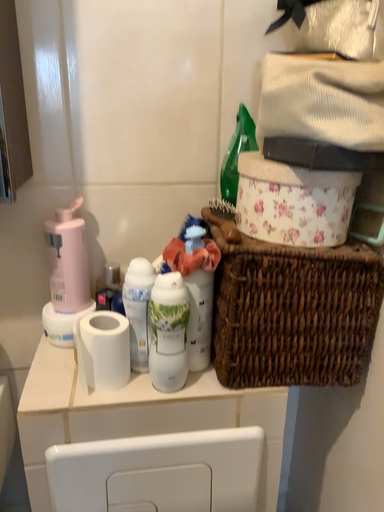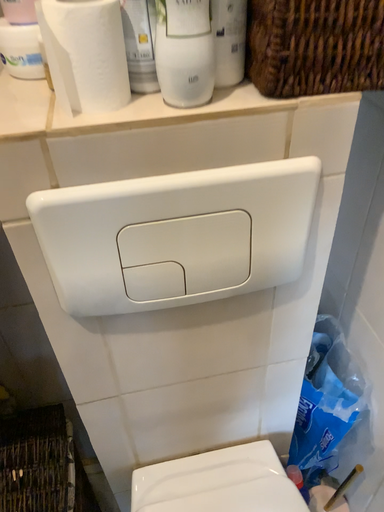
Question: How did the camera likely rotate when shooting the video?

Choices:
 (A) rotated upward
 (B) rotated downward

Answer: (B)